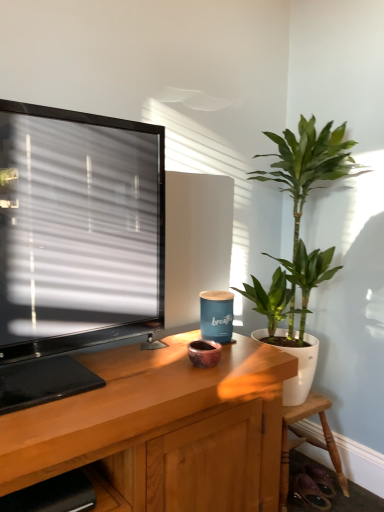
Question: Can you confirm if wooden chair at lower right is taller than wooden shelf at lower left?

Choices:
 (A) no
 (B) yes

Answer: (B)

Question: Could you tell me if wooden chair at lower right is facing wooden shelf at lower left?

Choices:
 (A) yes
 (B) no

Answer: (B)

Question: Can you confirm if wooden chair at lower right is smaller than wooden shelf at lower left?

Choices:
 (A) no
 (B) yes

Answer: (B)

Question: Would you consider wooden chair at lower right to be distant from wooden shelf at lower left?

Choices:
 (A) yes
 (B) no

Answer: (B)

Question: Does wooden chair at lower right appear on the left side of wooden shelf at lower left?

Choices:
 (A) yes
 (B) no

Answer: (B)

Question: From the image's perspective, is wooden chair at lower right above wooden shelf at lower left?

Choices:
 (A) yes
 (B) no

Answer: (B)

Question: Considering the relative positions of wooden shelf at lower left and wooden chair at lower right in the image provided, is wooden shelf at lower left behind wooden chair at lower right?

Choices:
 (A) no
 (B) yes

Answer: (A)

Question: Does wooden shelf at lower left have a greater height compared to wooden chair at lower right?

Choices:
 (A) no
 (B) yes

Answer: (A)

Question: Is wooden shelf at lower left bigger than wooden chair at lower right?

Choices:
 (A) no
 (B) yes

Answer: (B)

Question: Is wooden shelf at lower left at the right side of wooden chair at lower right?

Choices:
 (A) yes
 (B) no

Answer: (B)

Question: From a real-world perspective, is wooden shelf at lower left physically below wooden chair at lower right?

Choices:
 (A) no
 (B) yes

Answer: (A)

Question: Does wooden shelf at lower left have a lesser width compared to wooden chair at lower right?

Choices:
 (A) no
 (B) yes

Answer: (A)

Question: Is wooden chair at lower right at the left side of green glossy plant at right?

Choices:
 (A) yes
 (B) no

Answer: (B)